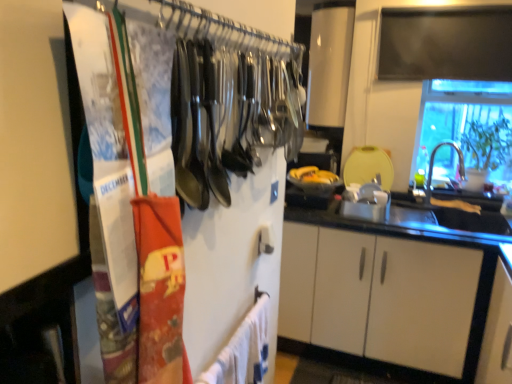
Question: Considering the positions of silver metallic faucet at right and metallic silver utensils at upper left in the image, is silver metallic faucet at right wider or thinner than metallic silver utensils at upper left?

Choices:
 (A) thin
 (B) wide

Answer: (A)

Question: Relative to metallic silver utensils at upper left, is silver metallic faucet at right in front or behind?

Choices:
 (A) front
 (B) behind

Answer: (B)

Question: Which of these objects is positioned farthest from the transparent glass window at upper right?

Choices:
 (A) metallic silver utensils at upper left
 (B) yellow matte banana at center
 (C) silver metallic faucet at right
 (D) white cotton bath towel at lower center

Answer: (D)

Question: Estimate the real-world distances between objects in this image. Which object is closer to the yellow matte banana at center?

Choices:
 (A) white cotton bath towel at lower center
 (B) metallic silver utensils at upper left
 (C) silver metallic faucet at right
 (D) transparent glass window at upper right

Answer: (C)